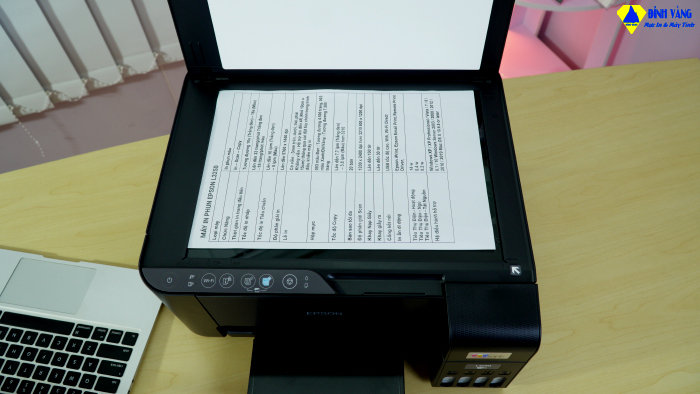
You are a GUI agent. You are given a task and a screenshot of the screen. Output one action in this format:
    pyautogui.click(x=<x>, y=<y>)
    Task: Click on the wall
    The image size is (700, 394).
    Given the screenshot: What is the action you would take?
    pyautogui.click(x=126, y=120)